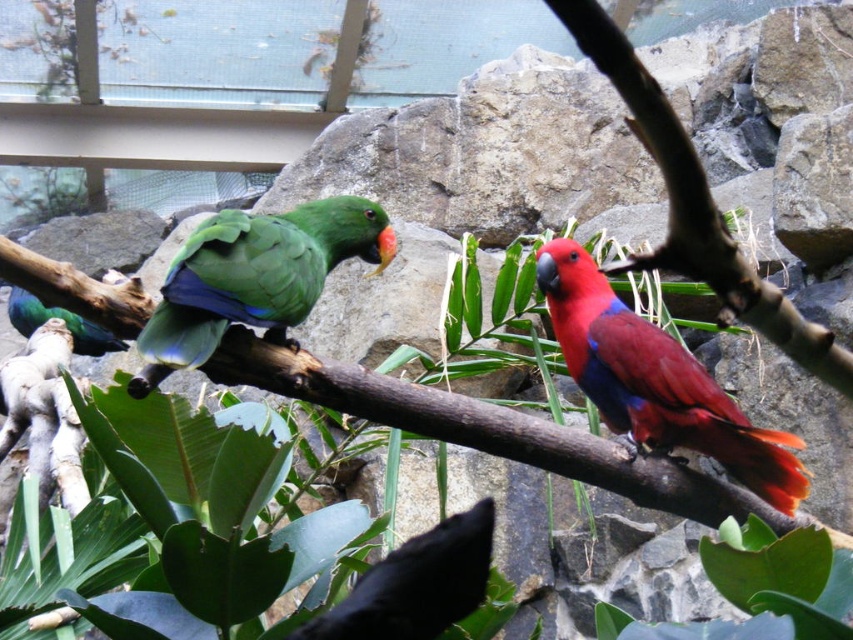
You are a zookeeper standing at the entrance of the aviary and want to feed the parrots. There is a feeding station located at point (312, 292). If you need to reach the station within 3 meters to feed them, can you do it?

The distance of point (312, 292) from camera is 2.76 meters, so yes, you can reach the feeding station within 3 meters to feed the parrots.

You are a zookeeper who needs to place a feeding tray between the shiny crimson parrot at right and the shiny green parrot at left. Since the tray must be placed at the same height as the taller bird, which parrot should you align the tray with?

The shiny crimson parrot at right is taller than the shiny green parrot at left, so the feeding tray should be aligned with the shiny crimson parrot at right to match its height.

You are a zookeeper trying to feed the parrots. You have a small treat in your hand. Which parrot, the shiny crimson parrot at right or the shiny green parrot at left, is closer to you so you can reach it first?

The shiny crimson parrot at right is closer to you because it is in front of the shiny green parrot at left, making it reachable first.